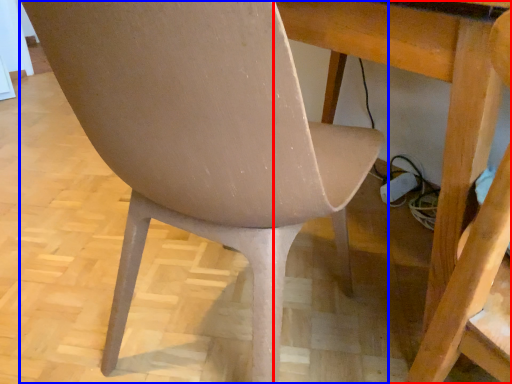
Question: Which point is closer to the camera, table (highlighted by a red box) or chair (highlighted by a blue box)?

Choices:
 (A) table
 (B) chair

Answer: (B)